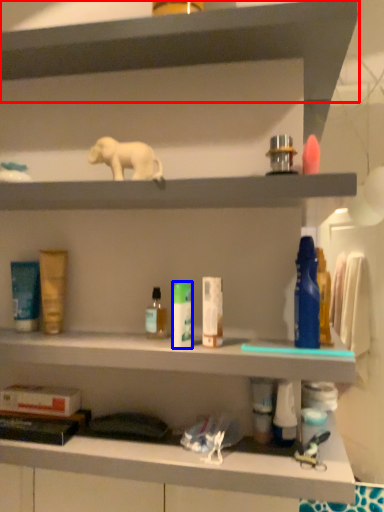
Question: Which object is closer to the camera taking this photo, shelf (highlighted by a red box) or toiletry (highlighted by a blue box)?

Choices:
 (A) shelf
 (B) toiletry

Answer: (A)